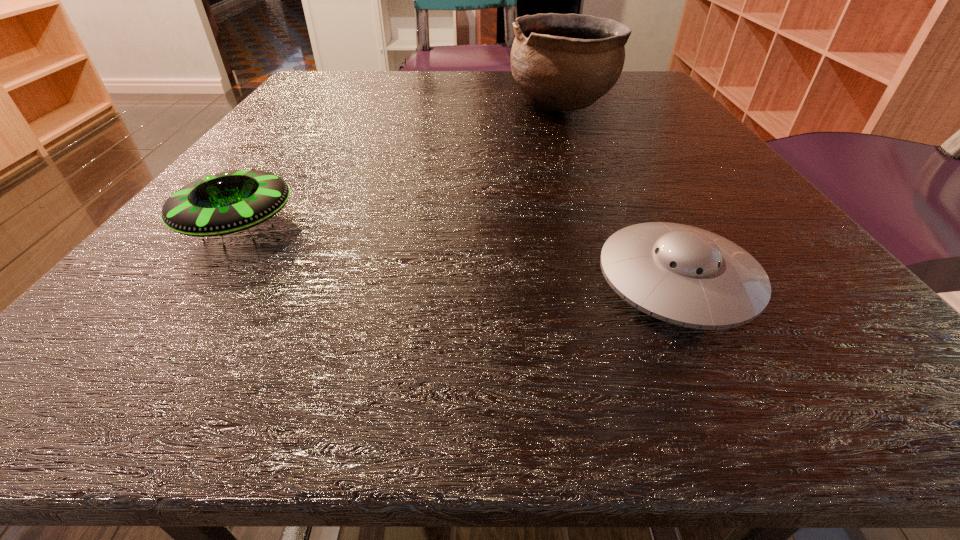
You are a GUI agent. You are given a task and a screenshot of the screen. Output one action in this format:
    pyautogui.click(x=<x>, y=<y>)
    Task: Click on the vacant space that's between the shortest object and the left saucer
    The height and width of the screenshot is (540, 960).
    Given the screenshot: What is the action you would take?
    pyautogui.click(x=458, y=253)

Image resolution: width=960 pixels, height=540 pixels. In order to click on object that stands as the closest to the leftmost object in this screenshot , I will do `click(684, 275)`.

Where is `object that stands as the second closest to the pottery`? The image size is (960, 540). object that stands as the second closest to the pottery is located at coordinates pyautogui.click(x=224, y=201).

Identify the location of vacant space that satisfies the following two spatial constraints: 1. on the back side of the tallest object; 2. on the right side of the taller saucer. (326, 104).

At what (x,y) coordinates should I click in order to perform the action: click on blank space that satisfies the following two spatial constraints: 1. on the back side of the farthest object; 2. on the right side of the left saucer. Please return your answer as a coordinate pair (x, y). The width and height of the screenshot is (960, 540). Looking at the image, I should click on (326, 104).